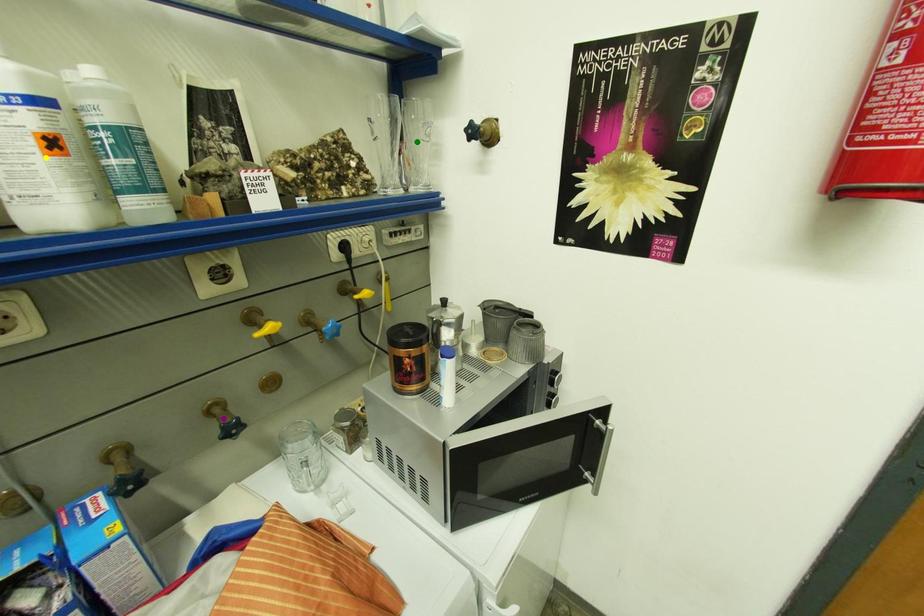
Order these from nearest to farthest:
yellow point
purple point
green point

1. yellow point
2. purple point
3. green point